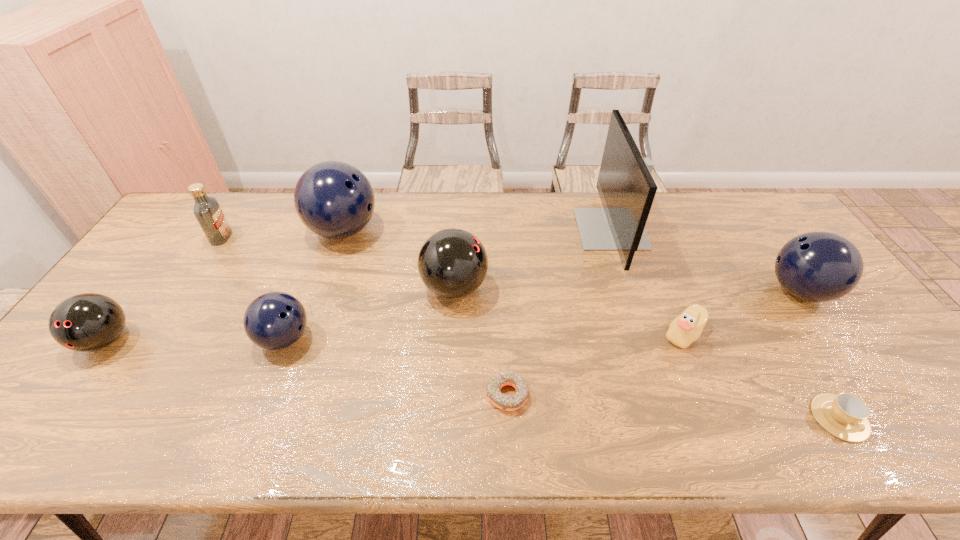
Choose which blue bowling ball is the second nearest neighbor to the biggest blue bowling ball. Please provide its 2D coordinates. Your answer should be formatted as a tuple, i.e. [(x, y)], where the tuple contains the x and y coordinates of a point satisfying the conditions above.

[(818, 266)]

Find the location of a particular element. vacant space that satisfies the following two spatial constraints: 1. on the surface of the smallest blue bowling ball near the finger holes; 2. on the right side of the shortest object is located at coordinates (263, 395).

Locate an element on the screen. free point that satisfies the following two spatial constraints: 1. on the surface of the smallest blue bowling ball near the finger holes; 2. on the surface of the leftmost bowling ball near the finger holes is located at coordinates (284, 340).

This screenshot has height=540, width=960. I want to click on vacant space that satisfies the following two spatial constraints: 1. on the back side of the shortest object; 2. on the surface of the smallest blue bowling ball near the finger holes, so click(x=505, y=339).

Image resolution: width=960 pixels, height=540 pixels. Find the location of `vacant region that satisfies the following two spatial constraints: 1. on the surface of the nearest blue bowling ball near the finger holes; 2. on the left side of the chocolate doughnut`. vacant region that satisfies the following two spatial constraints: 1. on the surface of the nearest blue bowling ball near the finger holes; 2. on the left side of the chocolate doughnut is located at coordinates tap(263, 395).